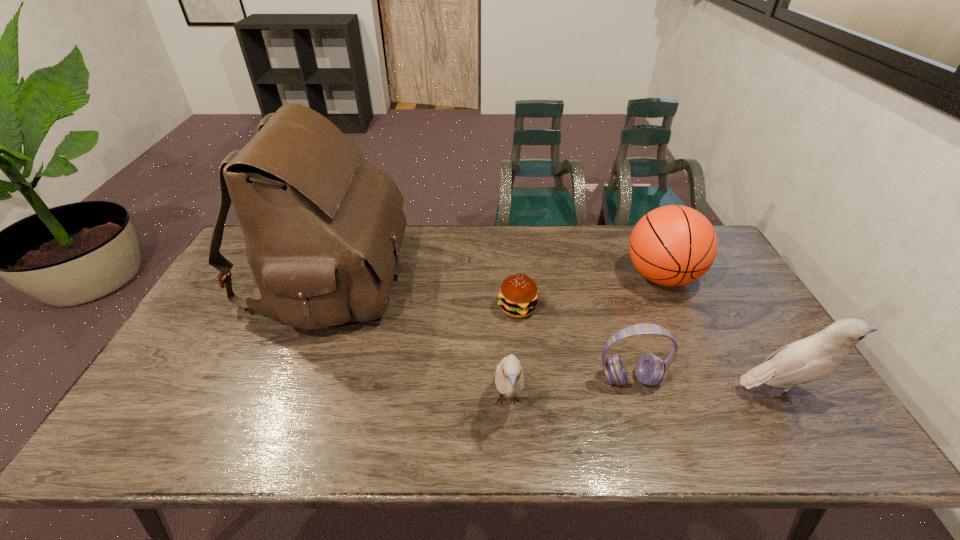
Identify the location of free point that keeps the birds evenly spaced on the left. [x=225, y=409].